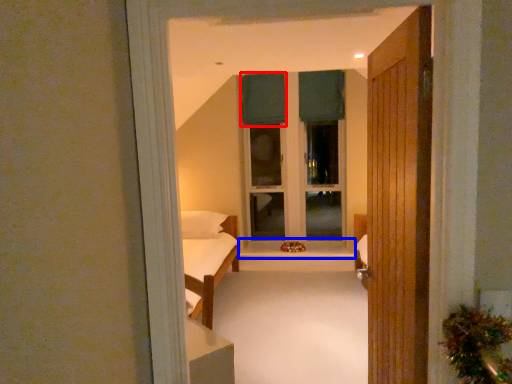
Question: Among these objects, which one is farthest to the camera, curtain (highlighted by a red box) or window sill (highlighted by a blue box)?

Choices:
 (A) curtain
 (B) window sill

Answer: (A)